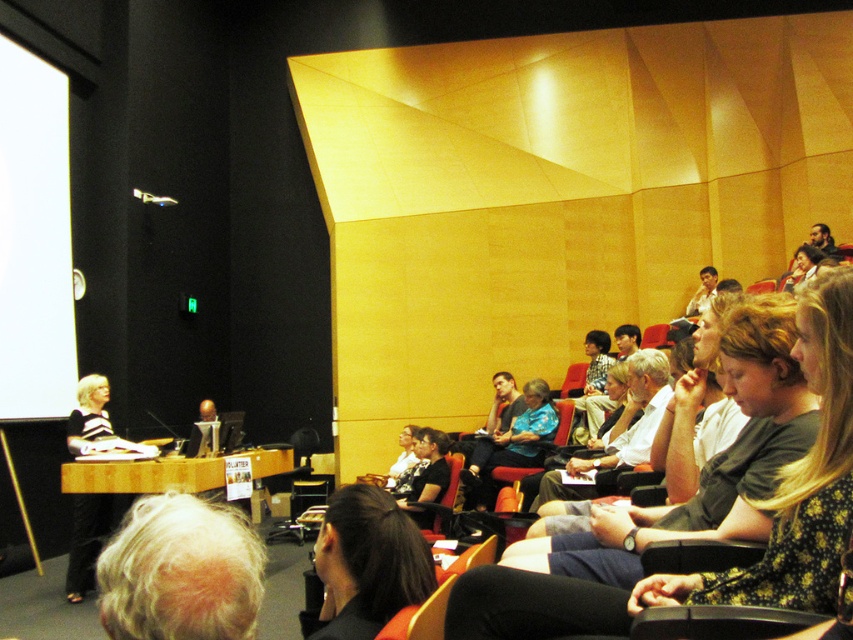
In the scene shown: You are an event organizer who needs to set up a camera for the presentation. The camera can only focus on objects that take up more space in the frame. Which object should you point the camera at between the white matte projection screen at left and the blue floral shirt at center?

The blue floral shirt at center takes up more space in the frame than the white matte projection screen at left, so you should point the camera at the blue floral shirt at center.

Based on the photo, you are standing in the lecture hall and need to locate the white matte projection screen at left. According to the coordinates provided, where exactly is it positioned?

The white matte projection screen at left is positioned at coordinates point (33, 240).